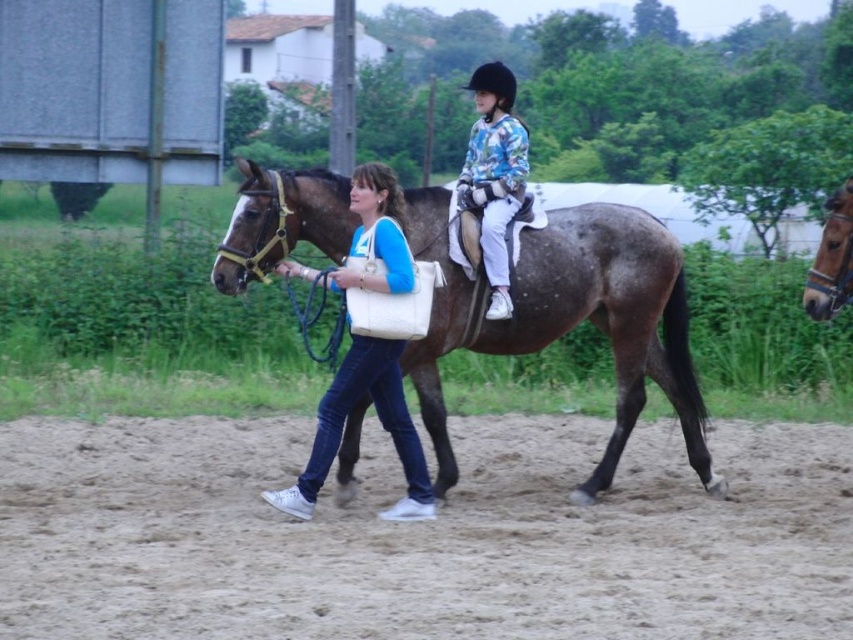
Question: Which object is closer to the camera taking this photo?

Choices:
 (A) floral jersey at center
 (B) blue denim jeans at center
 (C) brown glossy horse at center

Answer: (B)

Question: Which object is positioned closest to the floral jersey at center?

Choices:
 (A) blue denim jeans at center
 (B) brown glossy horse at right

Answer: (B)

Question: Which of the following is the closest to the observer?

Choices:
 (A) brown glossy horse at center
 (B) floral jersey at center
 (C) blue denim jeans at center
 (D) brown sandy ground at lower center

Answer: (D)

Question: Does blue denim jeans at center appear on the left side of floral jersey at center?

Choices:
 (A) no
 (B) yes

Answer: (B)

Question: Observing the image, what is the correct spatial positioning of brown glossy horse at center in reference to floral jersey at center?

Choices:
 (A) below
 (B) above

Answer: (A)

Question: Can you confirm if blue denim jeans at center is smaller than floral jersey at center?

Choices:
 (A) no
 (B) yes

Answer: (A)